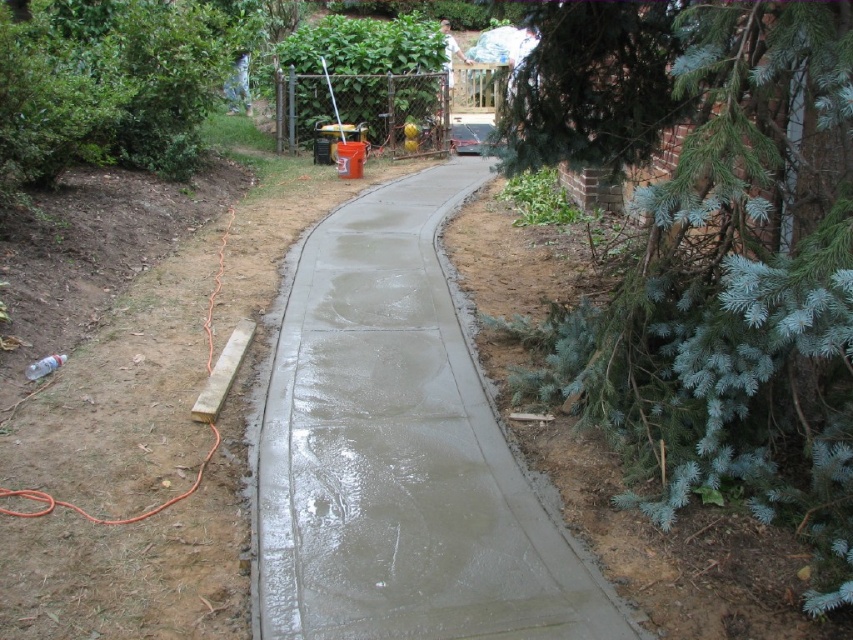
Question: Which object is positioned closest to the green leafy bush at left?

Choices:
 (A) smooth concrete at center
 (B) blue-green needles at right

Answer: (A)

Question: Does smooth concrete at center have a lesser width compared to green leafy bush at left?

Choices:
 (A) yes
 (B) no

Answer: (A)

Question: Which of the following is the farthest from the observer?

Choices:
 (A) smooth concrete at center
 (B) green leafy bush at left

Answer: (B)

Question: Is smooth concrete at center above green leafy bush at left?

Choices:
 (A) yes
 (B) no

Answer: (B)

Question: Which of the following is the farthest from the observer?

Choices:
 (A) green leafy bush at left
 (B) blue-green needles at right

Answer: (A)

Question: Is blue-green needles at right below smooth concrete at center?

Choices:
 (A) yes
 (B) no

Answer: (B)